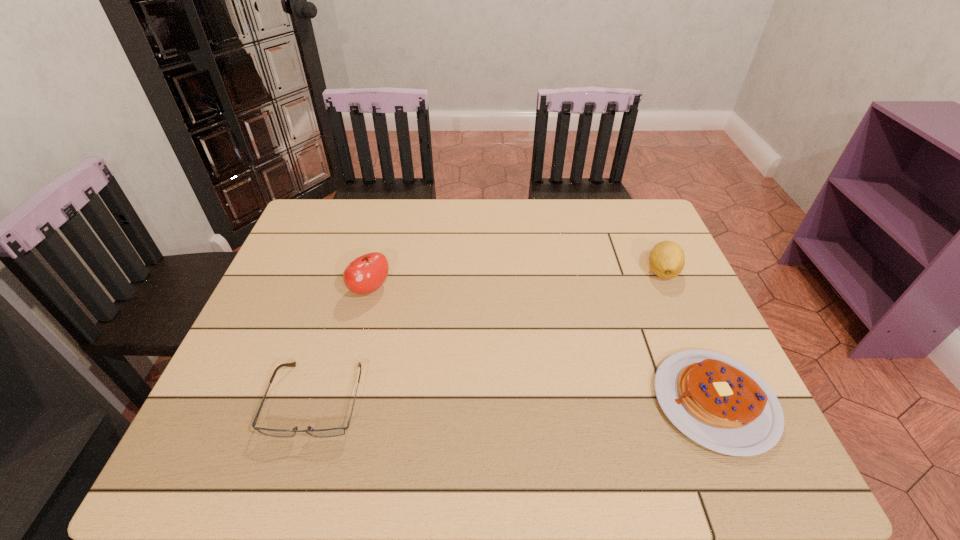
Find the location of a particular element. the shortest object is located at coordinates [332, 432].

The width and height of the screenshot is (960, 540). I want to click on pancake, so click(718, 402).

At what (x,y) coordinates should I click in order to perform the action: click on apple. Please return your answer as a coordinate pair (x, y). Image resolution: width=960 pixels, height=540 pixels. Looking at the image, I should click on (365, 274).

The height and width of the screenshot is (540, 960). Identify the location of lemon. (666, 259).

The image size is (960, 540). What are the coordinates of `vacant position located on the back of the pancake` in the screenshot? It's located at [x=656, y=266].

You are a GUI agent. You are given a task and a screenshot of the screen. Output one action in this format:
    pyautogui.click(x=<x>, y=<y>)
    Task: Click on the vacant space located on the stem of the tallest object
    The width and height of the screenshot is (960, 540).
    Given the screenshot: What is the action you would take?
    pyautogui.click(x=468, y=409)

The width and height of the screenshot is (960, 540). I want to click on vacant area situated 0.380m on the stem of the tallest object, so click(x=465, y=405).

Where is `blank space located 0.100m on the stem of the tallest object`? blank space located 0.100m on the stem of the tallest object is located at coordinates (398, 325).

Where is `free space located 0.160m at the stem end of the second tallest object`? This screenshot has width=960, height=540. free space located 0.160m at the stem end of the second tallest object is located at coordinates (631, 317).

The height and width of the screenshot is (540, 960). Identify the location of blank space located 0.130m at the stem end of the second tallest object. (636, 310).